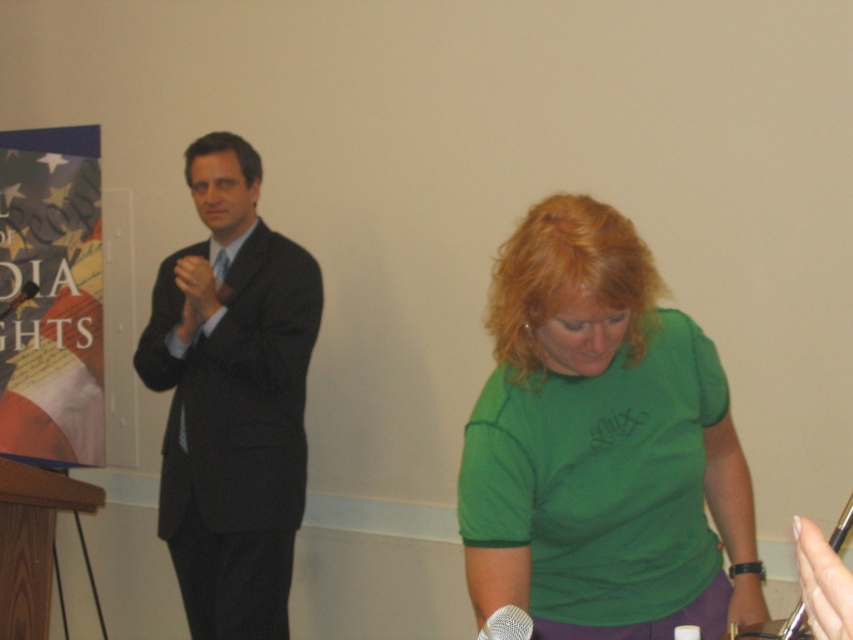
You are a stagehand who needs to place a 1.5 meter long table between the wooden at left and the silver metallic microphone at lower center. Is there enough space to fit the table horizontally between them?

The wooden at left is 1.36 meters from the silver metallic microphone at lower center. Since the table is 1.5 meters long, it would not fit horizontally between them as the distance is shorter than the table length.